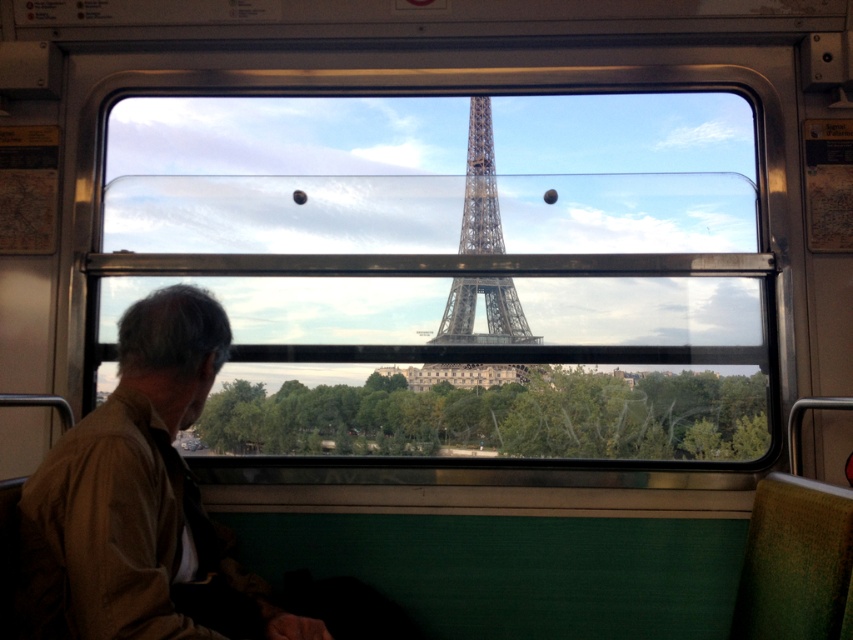
Does brown cotton shirt at left have a greater width compared to metallic gray eiffel tower at center?

Indeed, brown cotton shirt at left has a greater width compared to metallic gray eiffel tower at center.

Is brown cotton shirt at left above metallic gray eiffel tower at center?

Actually, brown cotton shirt at left is below metallic gray eiffel tower at center.

Which is in front, point (146, 452) or point (477, 109)?

Point (146, 452) is in front.

Where is `brown cotton shirt at left`? brown cotton shirt at left is located at coordinates (134, 493).